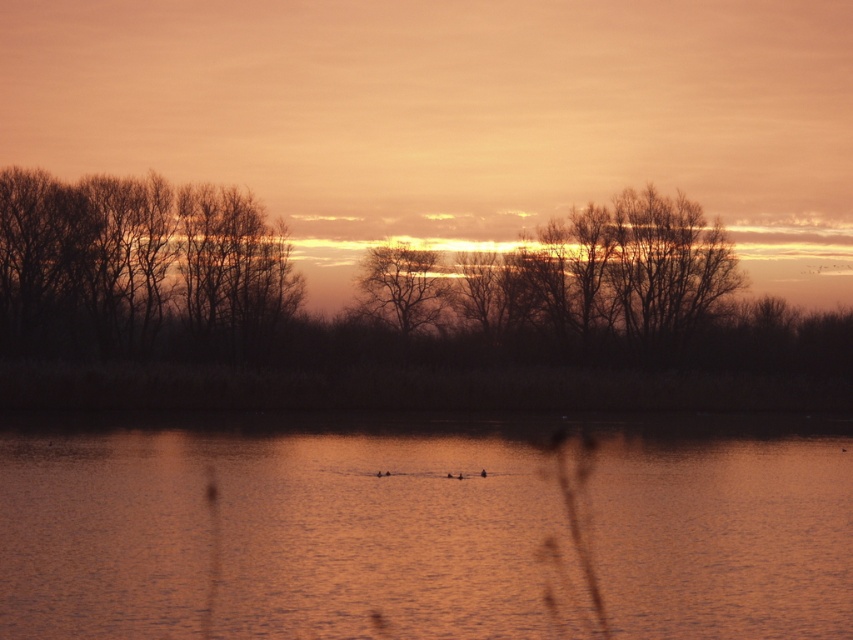
You are an artist trying to sketch this sunset scene. You want to ensure the bare branches at left and the silhouette bare tree at center are proportionally accurate. Which object should you draw wider in your sketch?

The bare branches at left should be drawn wider than the silhouette bare tree at center because the description states that the bare branches at left might be wider than the silhouette bare tree at center.